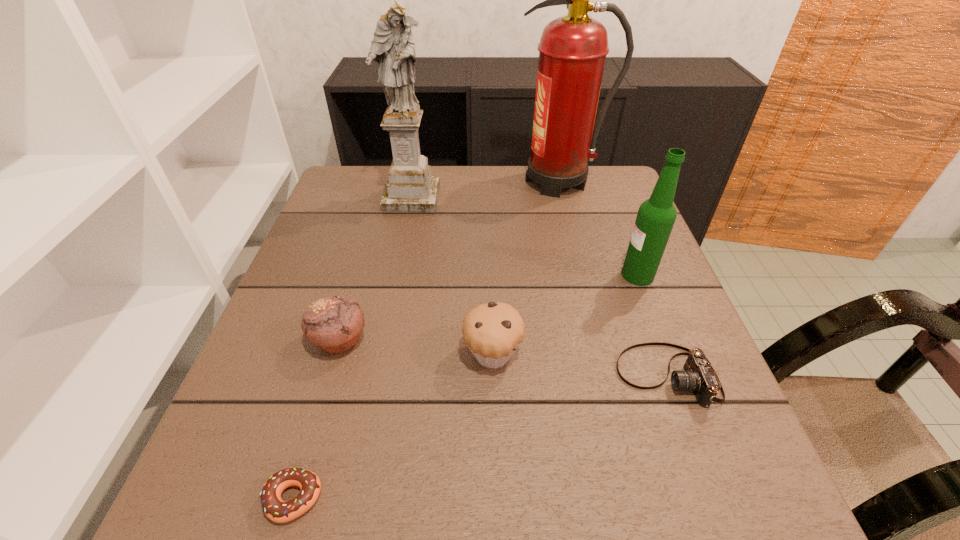
At what (x,y) coordinates should I click in order to perform the action: click on camera positioned at the right edge. Please return your answer as a coordinate pair (x, y). Looking at the image, I should click on coord(699,376).

The height and width of the screenshot is (540, 960). Find the location of `object that is at the far left corner`. object that is at the far left corner is located at coordinates (410, 187).

This screenshot has height=540, width=960. What are the coordinates of `object that is at the near left corner` in the screenshot? It's located at (277, 510).

At what (x,y) coordinates should I click in order to perform the action: click on object present at the far right corner. Please return your answer as a coordinate pair (x, y). The image size is (960, 540). Looking at the image, I should click on (572, 51).

Identify the location of vacant space at the far edge of the desktop. The height and width of the screenshot is (540, 960). (505, 211).

Identify the location of free space at the near edge of the desktop. (576, 478).

This screenshot has height=540, width=960. I want to click on free space at the left edge of the desktop, so click(x=348, y=255).

The image size is (960, 540). I want to click on vacant space at the right edge, so click(675, 331).

In the image, there is a desktop. Where is `vacant space at the far left corner`? The height and width of the screenshot is (540, 960). vacant space at the far left corner is located at coordinates (377, 190).

In the image, there is a desktop. Identify the location of blank space at the far right corner. This screenshot has width=960, height=540. (582, 197).